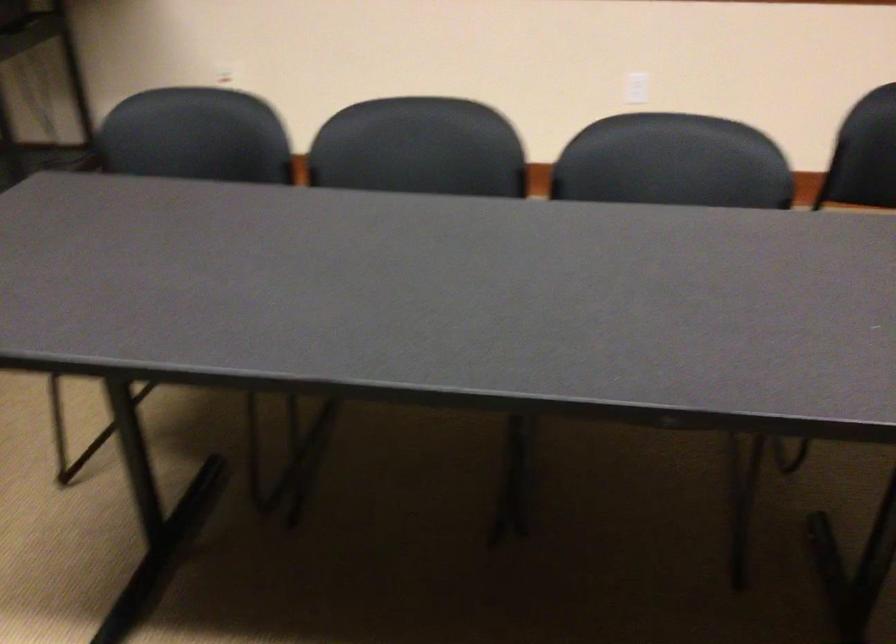
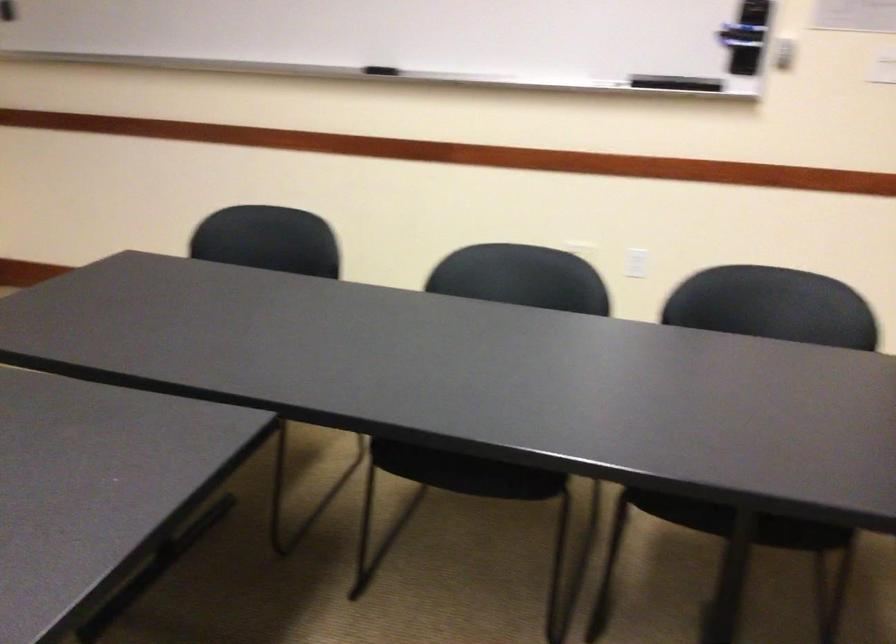
Question: The images are taken continuously from a first-person perspective. In which direction is your viewpoint rotating?

Choices:
 (A) Left
 (B) Right
 (C) Up
 (D) Down

Answer: (B)